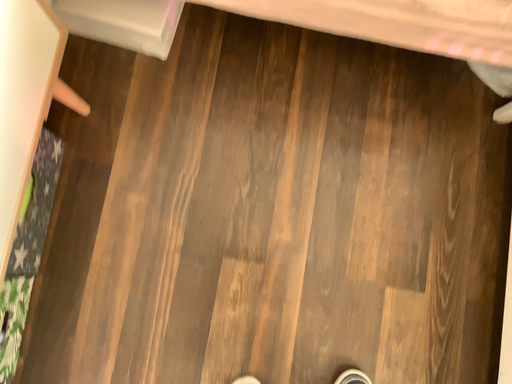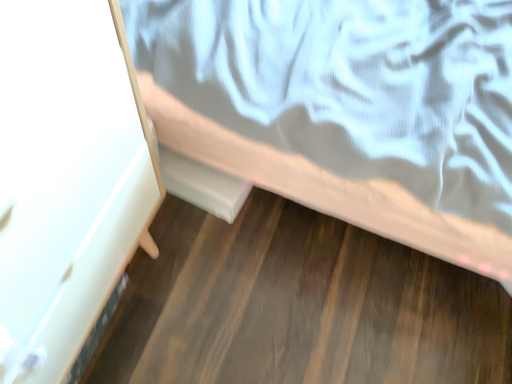
Question: How did the camera likely rotate when shooting the video?

Choices:
 (A) rotated upward
 (B) rotated downward

Answer: (A)